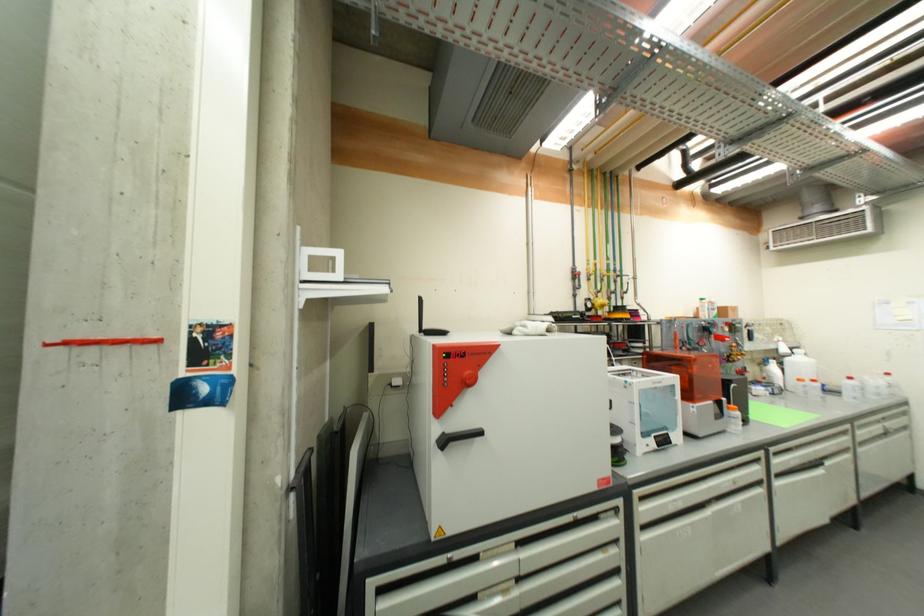
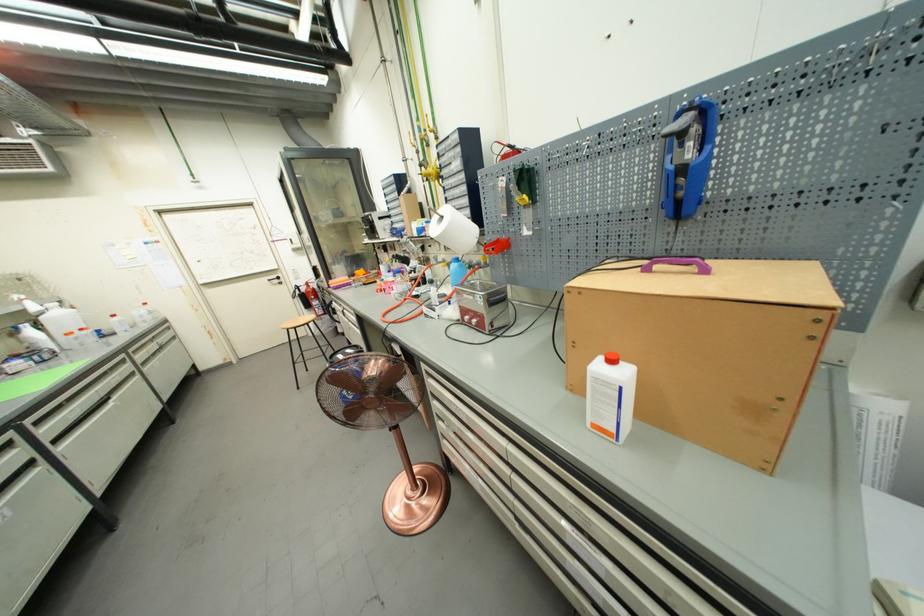
In the second image, find the point that corresponds to (864,442) in the first image.

(146, 363)